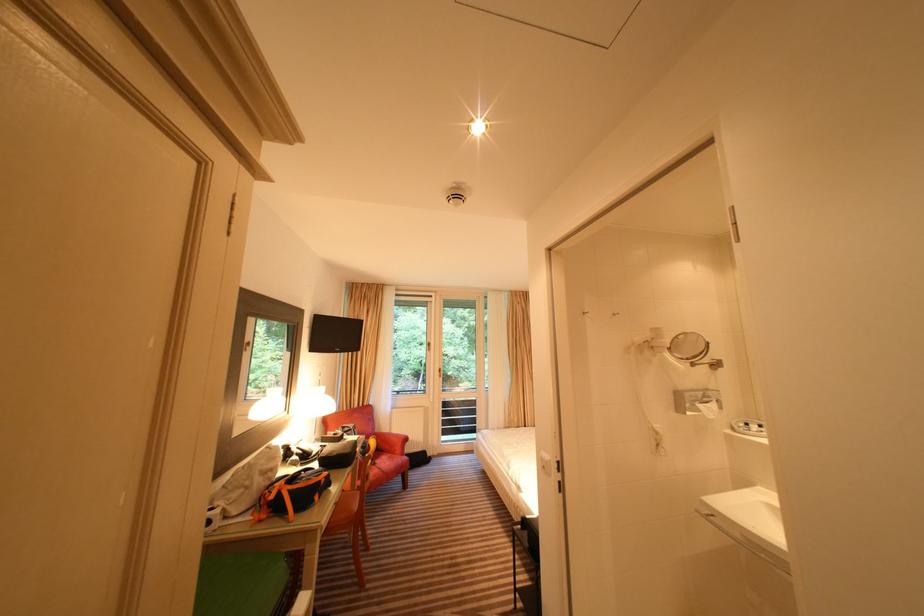
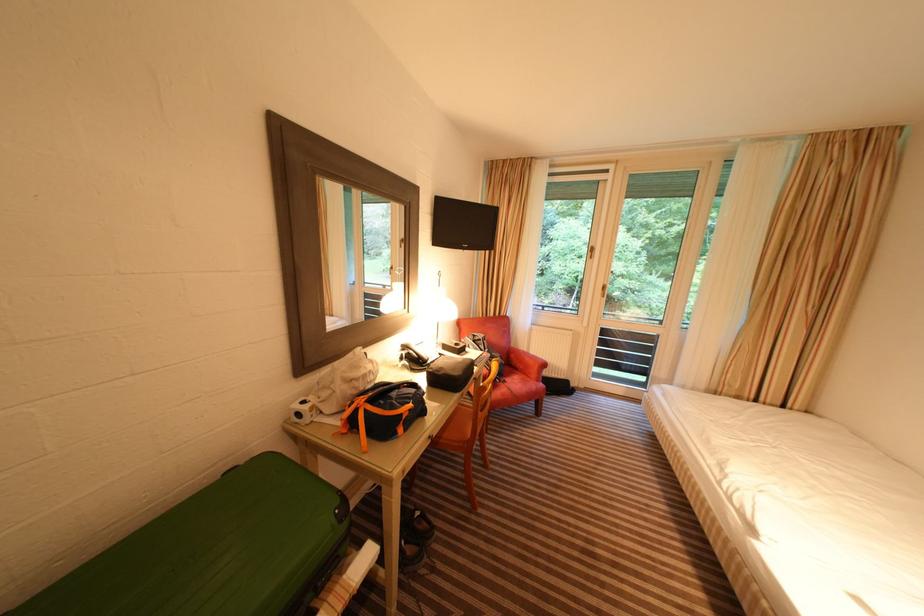
Where in the second image is the point corresponding to point (382, 466) from the first image?

(512, 384)